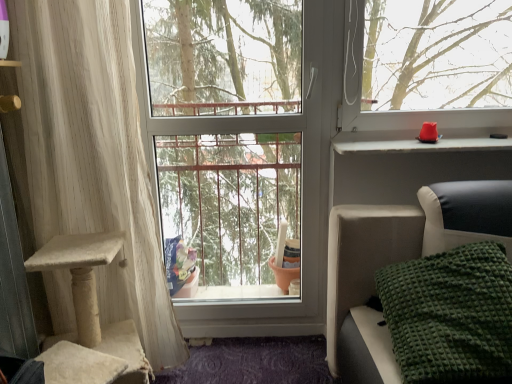
Measure the distance between point (x=428, y=145) and camera.

The depth of point (x=428, y=145) is 1.73 meters.

Describe the element at coordinates (94, 154) in the screenshot. I see `white textured curtain at left` at that location.

Describe the element at coordinates (226, 136) in the screenshot. The image size is (512, 384). I see `transparent glass window at center` at that location.

You are a GUI agent. You are given a task and a screenshot of the screen. Output one action in this format:
    pyautogui.click(x=<x>, y=<y>)
    Task: Click on the matte plastic window sill at upper right
    Image resolution: width=512 pixels, height=384 pixels.
    Given the screenshot: What is the action you would take?
    424,145

Is white textured curtain at left thinner than matte plastic window sill at upper right?

Yes.

This screenshot has height=384, width=512. I want to click on window sill above the white textured curtain at left (from a real-world perspective), so click(x=424, y=145).

From the picture: From the image's perspective, between matte plastic window sill at upper right and green textured blanket at lower right, which one is located above?

matte plastic window sill at upper right appears higher in the image.

Is matte plastic window sill at upper right taller than green textured blanket at lower right?

In fact, matte plastic window sill at upper right may be shorter than green textured blanket at lower right.

Consider the image. Between matte plastic window sill at upper right and green textured blanket at lower right, which one appears on the left side from the viewer's perspective?

From the viewer's perspective, green textured blanket at lower right appears more on the left side.

Is there a large distance between transparent glass window at center and green textured blanket at lower right?

No, transparent glass window at center is not far away from green textured blanket at lower right.

From their relative heights in the image, would you say transparent glass window at center is taller or shorter than green textured blanket at lower right?

transparent glass window at center is taller than green textured blanket at lower right.

Can you confirm if transparent glass window at center is positioned to the left of green textured blanket at lower right?

Yes, transparent glass window at center is to the left of green textured blanket at lower right.

Choose the correct answer: Is white textured curtain at left inside transparent glass window at center or outside it?

white textured curtain at left is not enclosed by transparent glass window at center.

Between white textured curtain at left and transparent glass window at center, which one is positioned in front?

white textured curtain at left is closer to the camera.

How different are the orientations of white textured curtain at left and transparent glass window at center in degrees?

The angle between the facing direction of white textured curtain at left and the facing direction of transparent glass window at center is 0.348 degrees.

Is white textured curtain at left smaller than transparent glass window at center?

Actually, white textured curtain at left might be larger than transparent glass window at center.

Considering the sizes of objects white textured curtain at left and green textured blanket at lower right in the image provided, who is smaller, white textured curtain at left or green textured blanket at lower right?

white textured curtain at left is smaller.

Considering the sizes of objects white textured curtain at left and green textured blanket at lower right in the image provided, who is thinner, white textured curtain at left or green textured blanket at lower right?

white textured curtain at left.

Which object is more forward, white textured curtain at left or green textured blanket at lower right?

green textured blanket at lower right is more forward.

Based on the photo, from the image's perspective, which is below, white textured curtain at left or green textured blanket at lower right?

green textured blanket at lower right appears lower in the image.

Considering the sizes of objects green textured blanket at lower right and transparent glass window at center in the image provided, who is thinner, green textured blanket at lower right or transparent glass window at center?

Thinner between the two is transparent glass window at center.

From the image's perspective, which is above, green textured blanket at lower right or transparent glass window at center?

transparent glass window at center is shown above in the image.

Considering the positions of objects green textured blanket at lower right and transparent glass window at center in the image provided, who is behind, green textured blanket at lower right or transparent glass window at center?

transparent glass window at center.

Based on the photo, does green textured blanket at lower right contain transparent glass window at center?

No, transparent glass window at center is not a part of green textured blanket at lower right.

Is matte plastic window sill at upper right at the left side of white textured curtain at left?

No, matte plastic window sill at upper right is not to the left of white textured curtain at left.

Locate an element on the screen. This screenshot has height=384, width=512. curtain below the matte plastic window sill at upper right (from the image's perspective) is located at coordinates (94, 154).

Considering the points (394, 141) and (120, 17), which point is in front, point (394, 141) or point (120, 17)?

The point (120, 17) is closer.

In the scene shown: Is matte plastic window sill at upper right touching white textured curtain at left?

No.

You are a GUI agent. You are given a task and a screenshot of the screen. Output one action in this format:
    pyautogui.click(x=<x>, y=<y>)
    Task: Click on the window sill that appears above the white textured curtain at left (from the image's perspective)
    
    Given the screenshot: What is the action you would take?
    pyautogui.click(x=424, y=145)

Where is `window sill behind the green textured blanket at lower right`? Image resolution: width=512 pixels, height=384 pixels. window sill behind the green textured blanket at lower right is located at coordinates (424, 145).

When comparing their distances from transparent glass window at center, does matte plastic window sill at upper right or white textured curtain at left seem further?

Based on the image, matte plastic window sill at upper right appears to be further to transparent glass window at center.

From the image, which object appears to be farther from green textured blanket at lower right, white textured curtain at left or transparent glass window at center?

transparent glass window at center.

Based on their spatial positions, is white textured curtain at left or green textured blanket at lower right further from matte plastic window sill at upper right?

white textured curtain at left is further to matte plastic window sill at upper right.

Based on their spatial positions, is matte plastic window sill at upper right or transparent glass window at center closer to white textured curtain at left?

transparent glass window at center.

Estimate the real-world distances between objects in this image. Which object is closer to transparent glass window at center, white textured curtain at left or matte plastic window sill at upper right?

Based on the image, white textured curtain at left appears to be nearer to transparent glass window at center.

Which object lies nearer to the anchor point white textured curtain at left, green textured blanket at lower right or matte plastic window sill at upper right?

green textured blanket at lower right lies closer to white textured curtain at left than the other object.

Which object lies nearer to the anchor point matte plastic window sill at upper right, white textured curtain at left or transparent glass window at center?

Based on the image, transparent glass window at center appears to be nearer to matte plastic window sill at upper right.

Which object lies further to the anchor point matte plastic window sill at upper right, transparent glass window at center or green textured blanket at lower right?

Based on the image, transparent glass window at center appears to be further to matte plastic window sill at upper right.

Find the location of a particular element. Image resolution: width=512 pixels, height=384 pixels. window screen between white textured curtain at left and matte plastic window sill at upper right is located at coordinates (226, 136).

This screenshot has height=384, width=512. Find the location of `furniture situated between white textured curtain at left and matte plastic window sill at upper right from left to right`. furniture situated between white textured curtain at left and matte plastic window sill at upper right from left to right is located at coordinates (398, 262).

This screenshot has width=512, height=384. In order to click on window screen located between green textured blanket at lower right and matte plastic window sill at upper right in the depth direction in this screenshot , I will do `click(226, 136)`.

Where is `window screen between white textured curtain at left and green textured blanket at lower right`? The width and height of the screenshot is (512, 384). window screen between white textured curtain at left and green textured blanket at lower right is located at coordinates (226, 136).